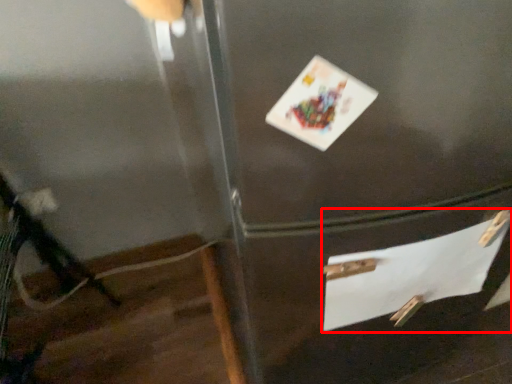
Question: From the image's perspective, what is the correct spatial positioning of drawer (annotated by the red box) in reference to postcard?

Choices:
 (A) below
 (B) above

Answer: (A)